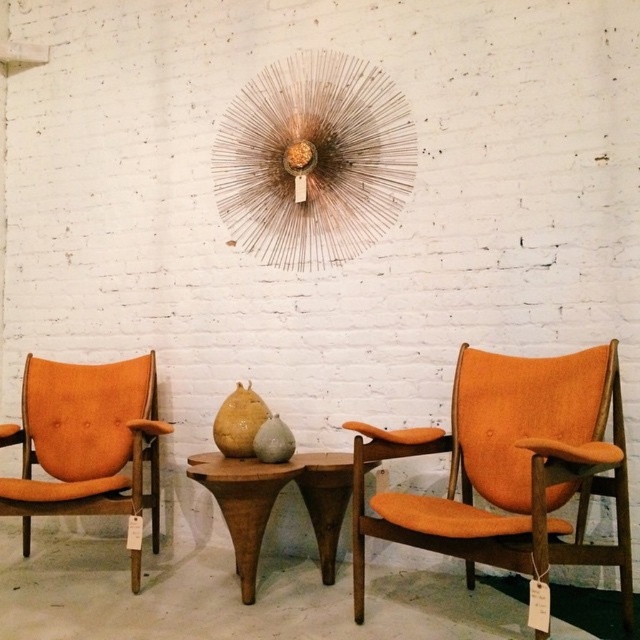
Question: Can you confirm if orange fabric armchair at left is smaller than wooden table at center?

Choices:
 (A) yes
 (B) no

Answer: (B)

Question: Is orange fabric armchair at left positioned in front of wooden table at center?

Choices:
 (A) yes
 (B) no

Answer: (B)

Question: Does orange fabric armchair at right appear on the left side of orange fabric armchair at left?

Choices:
 (A) yes
 (B) no

Answer: (B)

Question: Which object is closer to the camera taking this photo?

Choices:
 (A) wooden table at center
 (B) orange fabric armchair at left

Answer: (A)

Question: Which of the following is the closest to the observer?

Choices:
 (A) (595, 492)
 (B) (138, 481)
 (C) (237, 518)

Answer: (A)

Question: Among these points, which one is farthest from the camera?

Choices:
 (A) (138, 413)
 (B) (253, 552)
 (C) (518, 472)

Answer: (A)